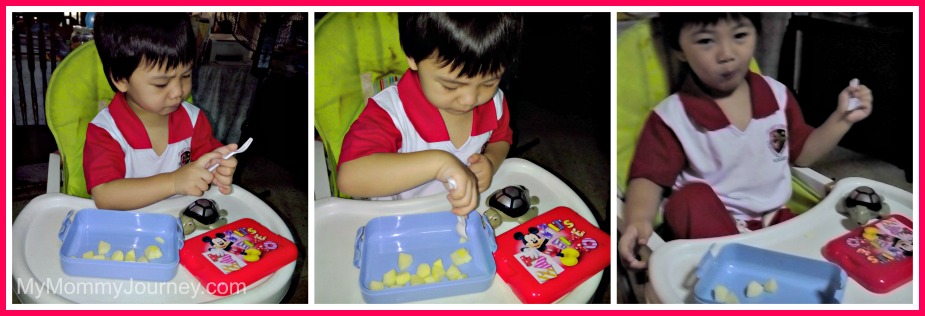
This screenshot has width=925, height=316. I want to click on tray, so click(x=434, y=236).